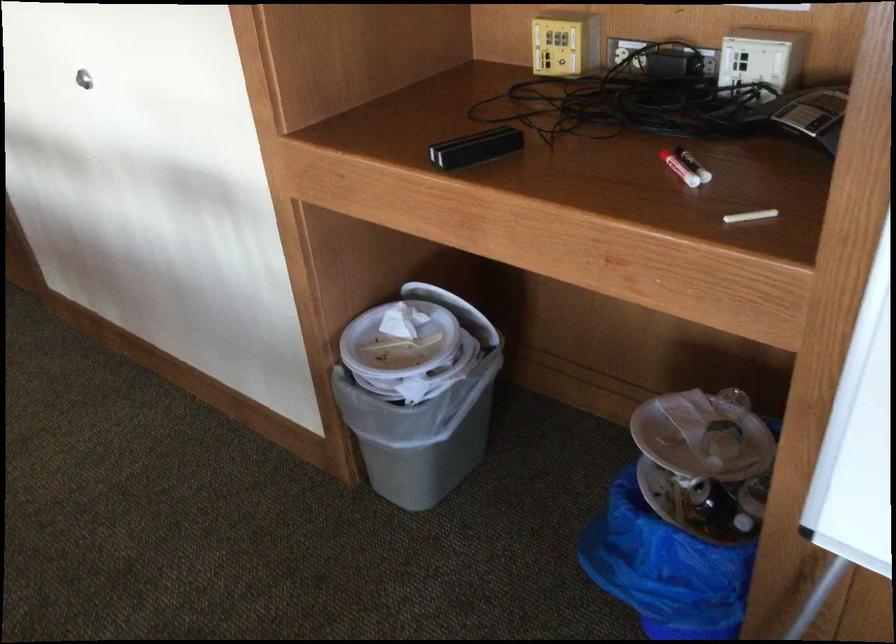
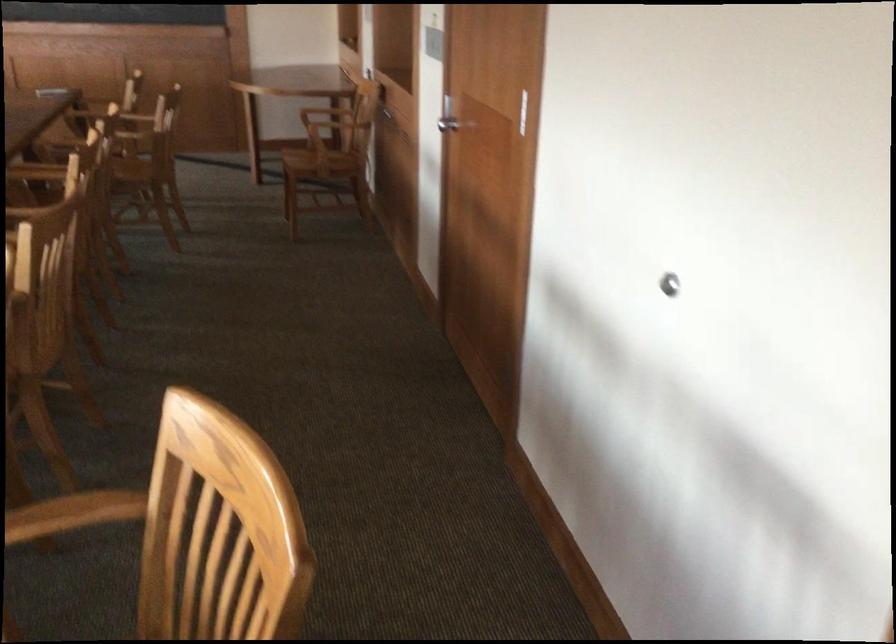
Question: The camera is either moving clockwise (left) or counter-clockwise (right) around the object. The first image is from the beginning of the video and the second image is from the end. Is the camera moving left or right when shooting the video?

Choices:
 (A) Left
 (B) Right

Answer: (B)